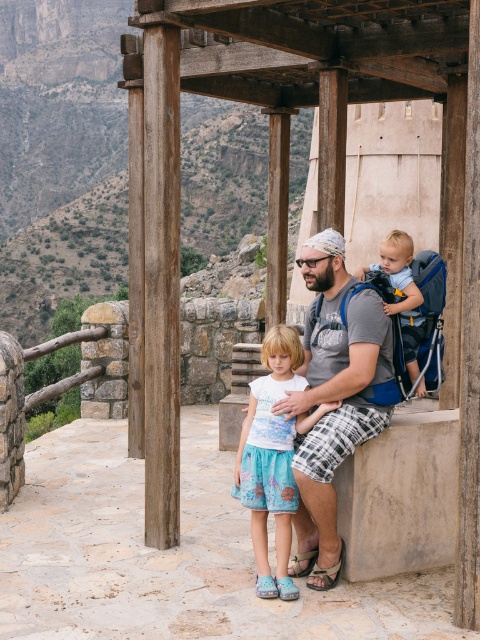
You are a visitor at this scenic overlook and want to take a photo of the wooden gazebo at center and the light blue cotton skirt at center. Which object should you focus on first if you want to capture both in the same frame without moving the camera?

The wooden gazebo at center is located above the light blue cotton skirt at center, so you should focus on the wooden gazebo at center first to ensure both are in the frame.

You are a tailor who needs to determine which fabric item requires more material between the gray fabric shirt at center and the light blue fabric baby carrier at center. Based on the scene, which one would need more fabric?

The gray fabric shirt at center has a larger size compared to the light blue fabric baby carrier at center, so it would require more fabric.